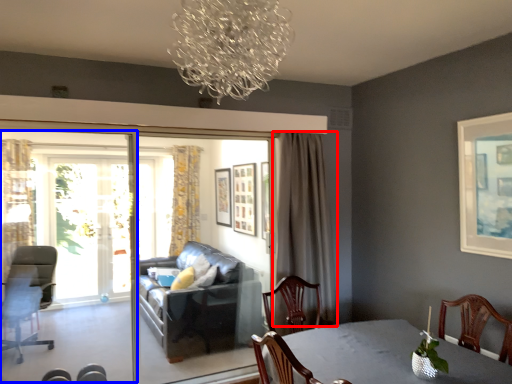
Question: Which point is closer to the camera, curtain (highlighted by a red box) or screen door (highlighted by a blue box)?

Choices:
 (A) curtain
 (B) screen door

Answer: (B)